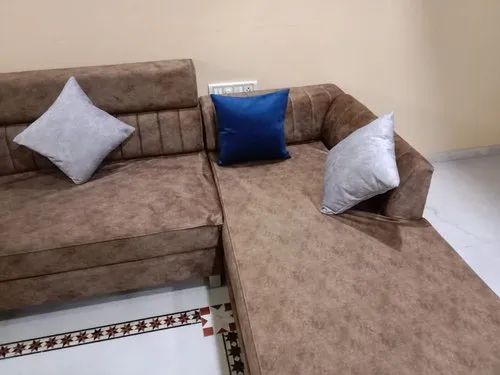
Where is `pillows`? The height and width of the screenshot is (375, 500). pillows is located at coordinates (88, 155), (261, 138), (381, 159).